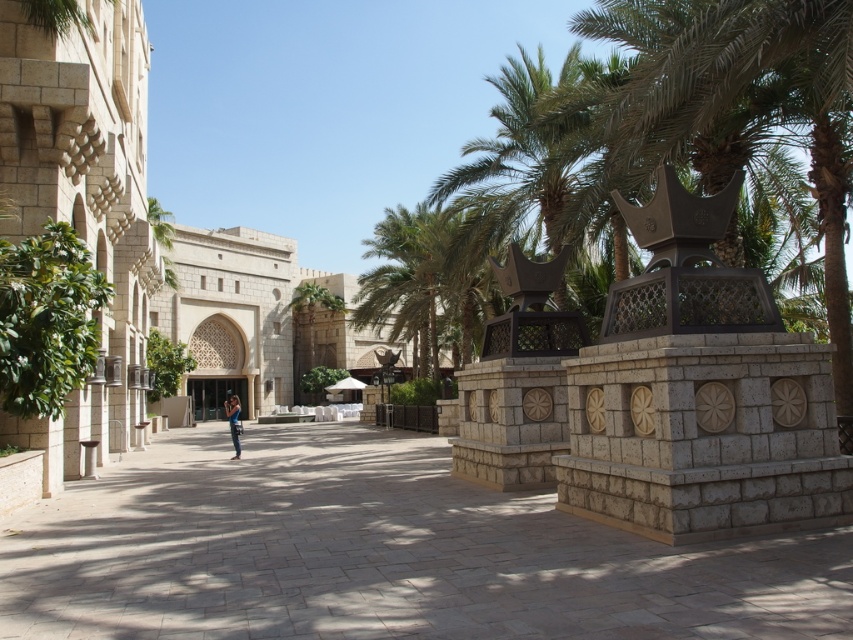
Question: Estimate the real-world distances between objects in this image. Which object is farther from the green leafy palm tree at center?

Choices:
 (A) beige stone palace at center
 (B) paved stone path at center
 (C) blue denim jeans at center

Answer: (B)

Question: Which point is farther to the camera?

Choices:
 (A) (277, 371)
 (B) (236, 445)

Answer: (A)

Question: Can you confirm if paved stone path at center is positioned to the left of green leafy palm tree at center?

Choices:
 (A) no
 (B) yes

Answer: (A)

Question: Which point is farther to the camera?

Choices:
 (A) pos(515,509)
 (B) pos(451,243)

Answer: (B)

Question: Is paved stone path at center further to the viewer compared to beige stone palace at center?

Choices:
 (A) no
 (B) yes

Answer: (A)

Question: Does paved stone path at center lie behind green leafy palm tree at center?

Choices:
 (A) no
 (B) yes

Answer: (A)